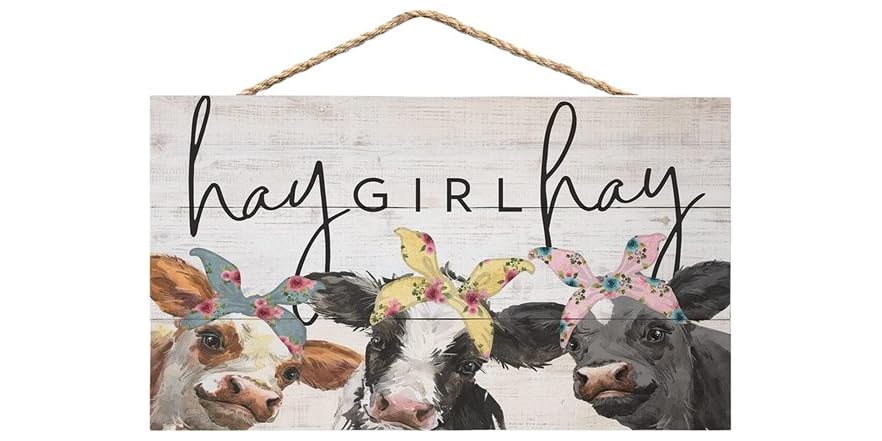
This screenshot has width=882, height=441. Identify the location of wood planks. (644, 145), (705, 240), (542, 394).